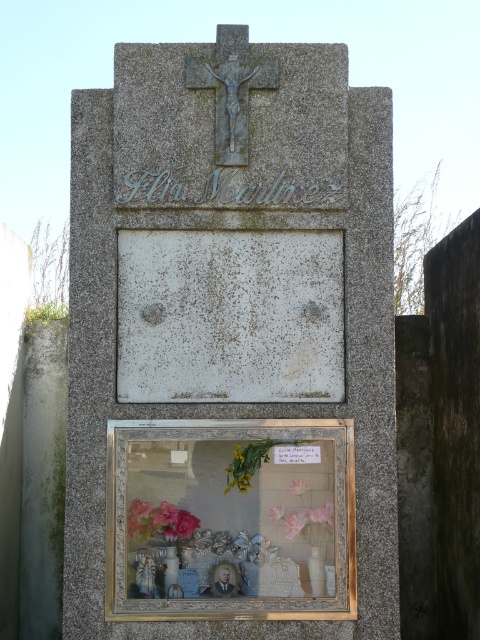
Question: Based on their relative distances, which object is farther from the pink matte flowers at lower left?

Choices:
 (A) pink matte flower at lower center
 (B) pink matte flower at center
 (C) pink fabric flower at center

Answer: (B)

Question: Based on their relative distances, which object is nearer to the granite cross at upper center?

Choices:
 (A) pink matte flower at center
 (B) pink matte flower at lower center
 (C) pink matte flowers at lower left

Answer: (C)

Question: Is pink matte flowers at lower left positioned behind pink matte flower at lower center?

Choices:
 (A) yes
 (B) no

Answer: (B)

Question: Is pink fabric flower at center below pink matte flower at center?

Choices:
 (A) no
 (B) yes

Answer: (B)

Question: Is granite cross at upper center above pink fabric flower at center?

Choices:
 (A) yes
 (B) no

Answer: (A)

Question: Based on their relative distances, which object is farther from the pink fabric flower at center?

Choices:
 (A) pink matte flower at center
 (B) pink matte flowers at lower left

Answer: (B)